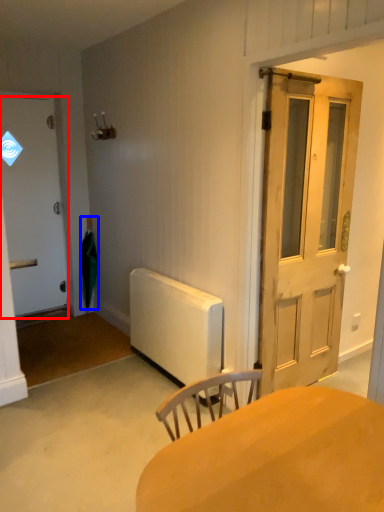
Question: Among these objects, which one is farthest to the camera, door (highlighted by a red box) or umbrella (highlighted by a blue box)?

Choices:
 (A) door
 (B) umbrella

Answer: (B)